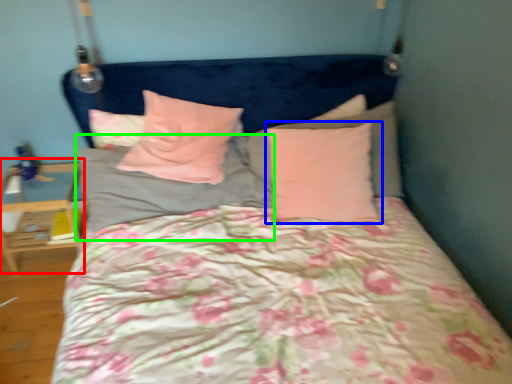
Question: Based on their relative distances, which object is nearer to table (highlighted by a red box)? Choose from pillow (highlighted by a blue box) and pillow (highlighted by a green box).

Choices:
 (A) pillow
 (B) pillow

Answer: (B)